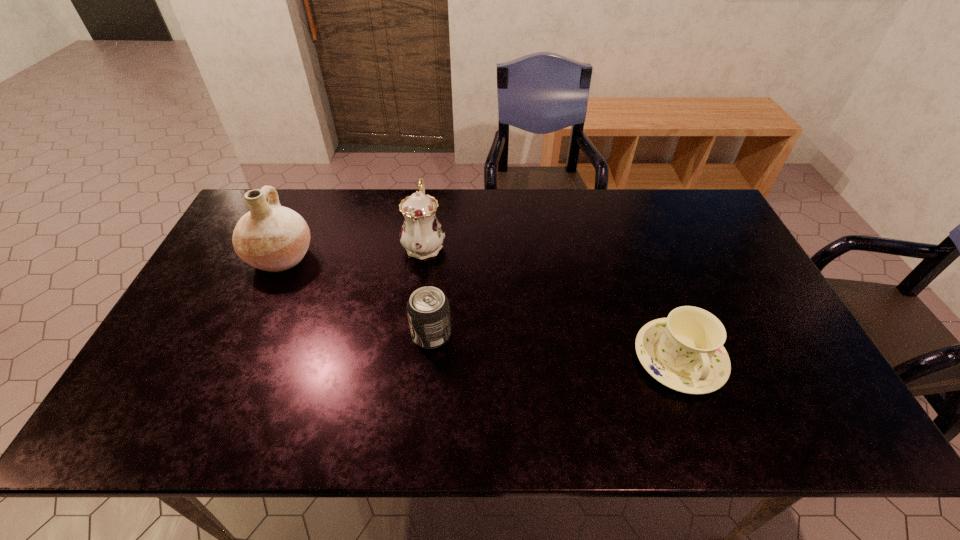
Where is `vacant area that lies between the shorter chinaware and the soda can`? This screenshot has height=540, width=960. vacant area that lies between the shorter chinaware and the soda can is located at coordinates (556, 347).

This screenshot has height=540, width=960. Find the location of `blank region between the leftmost object and the left chinaware`. blank region between the leftmost object and the left chinaware is located at coordinates coord(352,251).

Identify the location of free space between the right chinaware and the leftmost object. This screenshot has width=960, height=540. (480, 308).

Locate an element on the screen. This screenshot has width=960, height=540. free area in between the soda can and the nearer chinaware is located at coordinates (556, 347).

Identify the location of free spot between the rightmost object and the soda can. (556, 347).

The width and height of the screenshot is (960, 540). What are the coordinates of `vacant area between the rightmost object and the farther chinaware` in the screenshot? It's located at (552, 302).

Where is `object that ranks as the third closest to the taller chinaware`? The height and width of the screenshot is (540, 960). object that ranks as the third closest to the taller chinaware is located at coordinates (685, 352).

Select which object appears as the closest to the left chinaware. Please provide its 2D coordinates. Your answer should be formatted as a tuple, i.e. [(x, y)], where the tuple contains the x and y coordinates of a point satisfying the conditions above.

[(428, 310)]

Where is `free space that satisfies the following two spatial constraints: 1. to pour from the handle of the pottery; 2. on the right side of the soda can`? free space that satisfies the following two spatial constraints: 1. to pour from the handle of the pottery; 2. on the right side of the soda can is located at coordinates pyautogui.click(x=246, y=334).